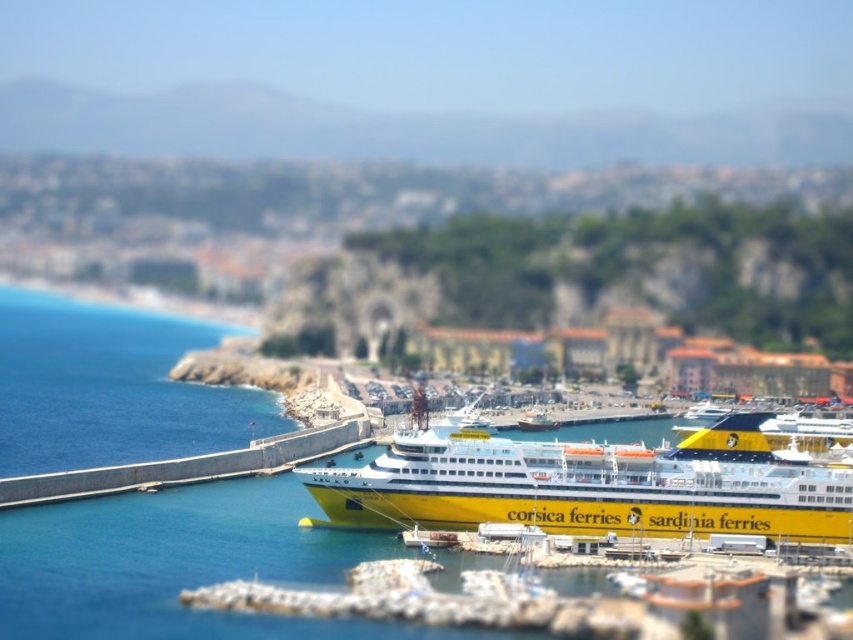
You are standing at the harbor and want to take a photo of the ferry boat. You notice two points marked on your map at coordinates point [347,468] and point [527,426]. Which point should you stand closer to if you want your photo to capture more of the ferry boat in the foreground?

You should stand closer to point [347,468] because it is closer to the camera than point [527,426], allowing you to capture more of the ferry boat in the foreground.

You are a drone operator tasked with capturing aerial footage of the harbor. The drone has a maximum flight distance of 70 meters from its starting point. If you position the drone above the concrete wall at lower left, can it reach the yellow matte ferry at center without exceeding its flight range?

The concrete wall at lower left and yellow matte ferry at center are 67.46 meters apart, so the drone can reach the yellow matte ferry at center as the distance is within the 70 meters range.